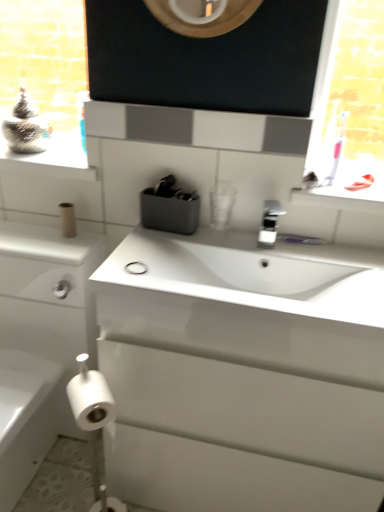
Question: Does white glossy sink at center have a smaller size compared to white glossy window sill at upper right?

Choices:
 (A) no
 (B) yes

Answer: (A)

Question: From a real-world perspective, is white glossy sink at center under white glossy window sill at upper right?

Choices:
 (A) yes
 (B) no

Answer: (A)

Question: Is white glossy sink at center facing away from white glossy window sill at upper right?

Choices:
 (A) no
 (B) yes

Answer: (A)

Question: Is white glossy sink at center shorter than white glossy window sill at upper right?

Choices:
 (A) no
 (B) yes

Answer: (A)

Question: Is white glossy sink at center aimed at white glossy window sill at upper right?

Choices:
 (A) yes
 (B) no

Answer: (B)

Question: Considering their positions, is white matte toilet paper at lower left, acting as the third toilet paper starting from the top, located in front of or behind white glossy cabinet at left?

Choices:
 (A) front
 (B) behind

Answer: (B)

Question: Is white matte toilet paper at lower left, which is the second toilet paper in back-to-front order, to the left or to the right of white glossy cabinet at left in the image?

Choices:
 (A) left
 (B) right

Answer: (B)

Question: Considering the positions of white matte toilet paper at lower left, which is the second toilet paper in back-to-front order, and white glossy cabinet at left in the image, is white matte toilet paper at lower left, which is the second toilet paper in back-to-front order, wider or thinner than white glossy cabinet at left?

Choices:
 (A) wide
 (B) thin

Answer: (B)

Question: Considering the positions of white matte toilet paper at lower left, the first toilet paper positioned from the bottom, and white glossy cabinet at left in the image, is white matte toilet paper at lower left, the first toilet paper positioned from the bottom, bigger or smaller than white glossy cabinet at left?

Choices:
 (A) big
 (B) small

Answer: (B)

Question: Considering the positions of point (122, 507) and point (74, 49), is point (122, 507) closer or farther from the camera than point (74, 49)?

Choices:
 (A) closer
 (B) farther

Answer: (A)

Question: From the image's perspective, is white matte toilet paper at lower left, the first toilet paper positioned from the bottom, positioned above or below metallic silver container at upper left?

Choices:
 (A) below
 (B) above

Answer: (A)

Question: Is white matte toilet paper at lower left, acting as the third toilet paper starting from the top, spatially inside metallic silver container at upper left, or outside of it?

Choices:
 (A) outside
 (B) inside

Answer: (A)

Question: In the image, is white matte toilet paper at lower left, the first toilet paper positioned from the bottom, positioned in front of or behind metallic silver container at upper left?

Choices:
 (A) front
 (B) behind

Answer: (A)

Question: From a real-world perspective, relative to silver metallic faucet at center, is white glossy sink at center vertically above or below?

Choices:
 (A) above
 (B) below

Answer: (B)

Question: Considering the positions of white glossy sink at center and silver metallic faucet at center in the image, is white glossy sink at center bigger or smaller than silver metallic faucet at center?

Choices:
 (A) big
 (B) small

Answer: (A)